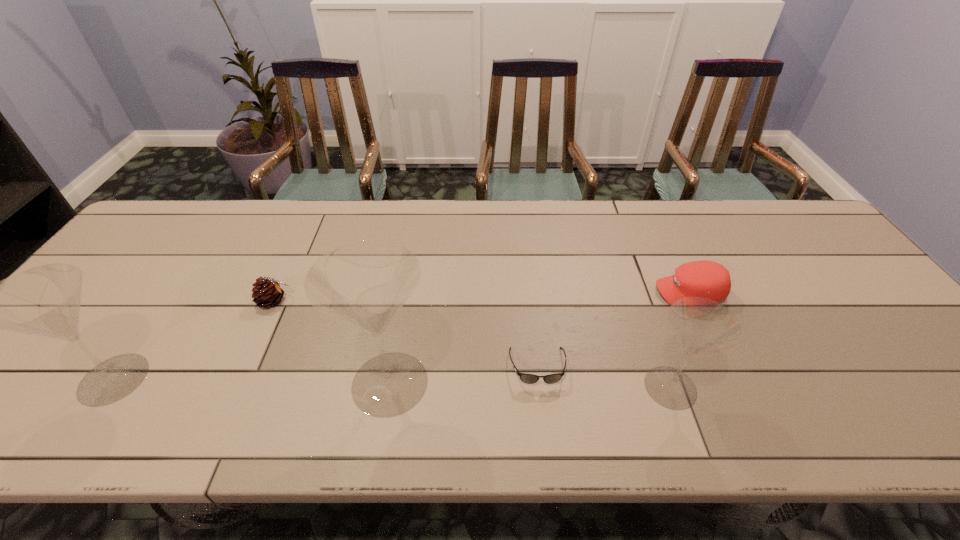
Please point a free position for a flute glass on the right. Please provide its 2D coordinates. Your answer should be formatted as a tuple, i.e. [(x, y)], where the tuple contains the x and y coordinates of a point satisfying the conditions above.

[(956, 392)]